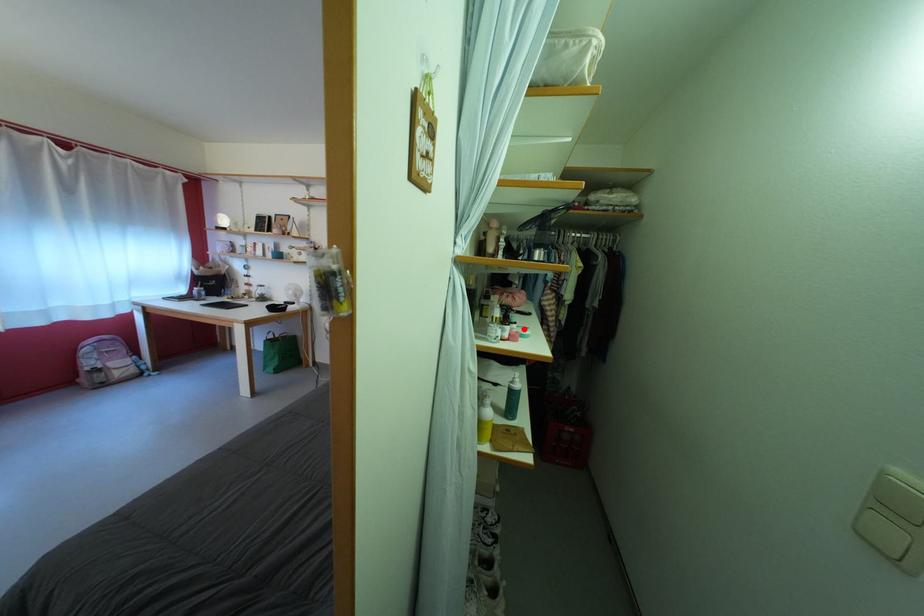
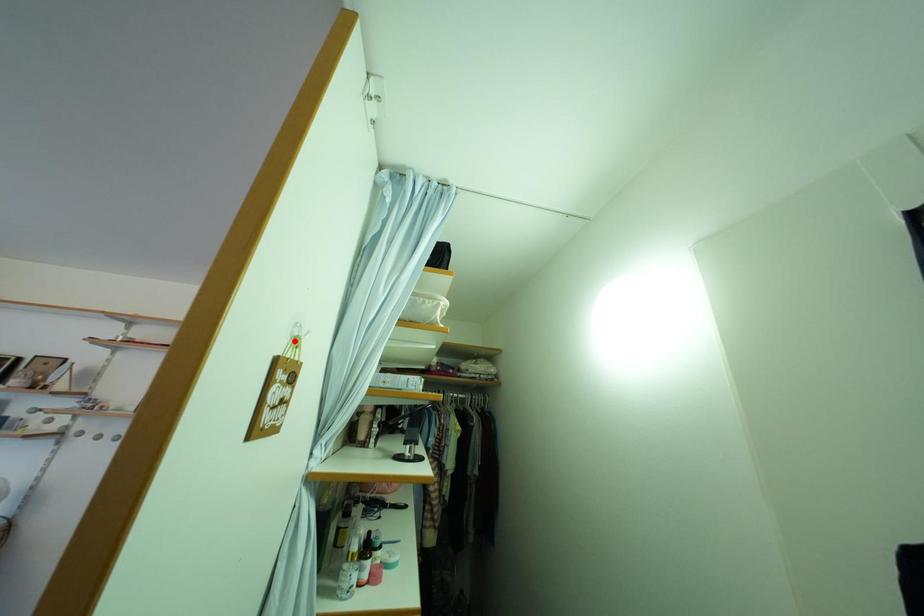
I am providing you with two images of the same scene from different viewpoints. A red point is marked on the first image and another point is marked on the second image. Is the marked point in image1 the same physical position as the marked point in image2?

No